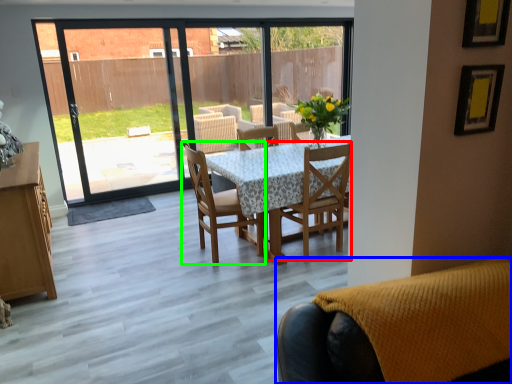
Question: Estimate the real-world distances between objects in this image. Which object is farther from chair (highlighted by a red box), chair (highlighted by a blue box) or chair (highlighted by a green box)?

Choices:
 (A) chair
 (B) chair

Answer: (A)